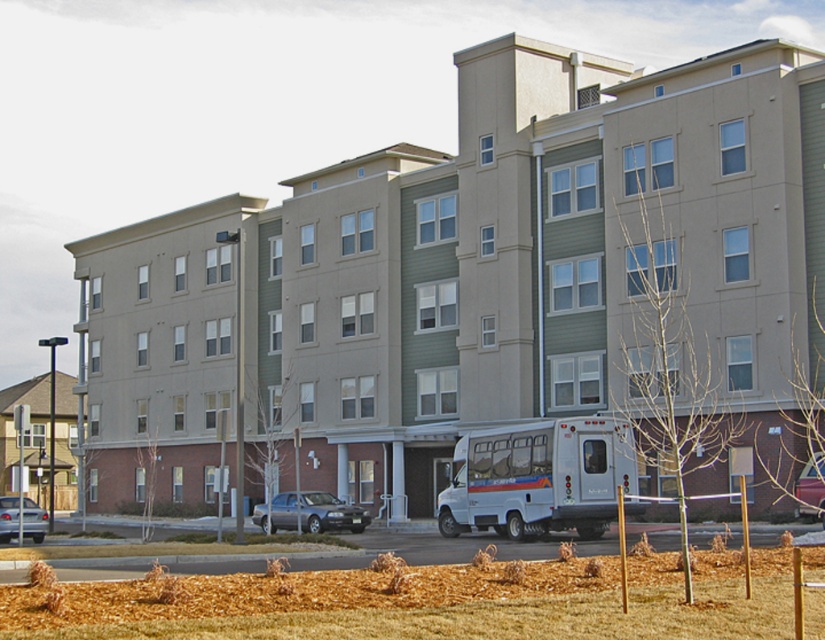
Question: Which object is closer to the camera taking this photo?

Choices:
 (A) silver metallic sedan at lower left
 (B) metallic silver sedan at center
 (C) white matte bus at lower center
 (D) silver metallic sedan at center

Answer: (B)

Question: Which object appears closest to the camera in this image?

Choices:
 (A) white matte bus at lower center
 (B) silver metallic sedan at center
 (C) silver metallic sedan at lower left

Answer: (A)

Question: Where is brown mulch at lower center located in relation to metallic silver sedan at center in the image?

Choices:
 (A) left
 (B) right

Answer: (A)

Question: Which of the following is the farthest from the observer?

Choices:
 (A) (0, 540)
 (B) (818, 483)

Answer: (A)

Question: Can you confirm if silver metallic sedan at center is positioned to the left of silver metallic sedan at lower left?

Choices:
 (A) no
 (B) yes

Answer: (A)

Question: Is the position of silver metallic sedan at lower left more distant than that of metallic silver sedan at center?

Choices:
 (A) no
 (B) yes

Answer: (B)